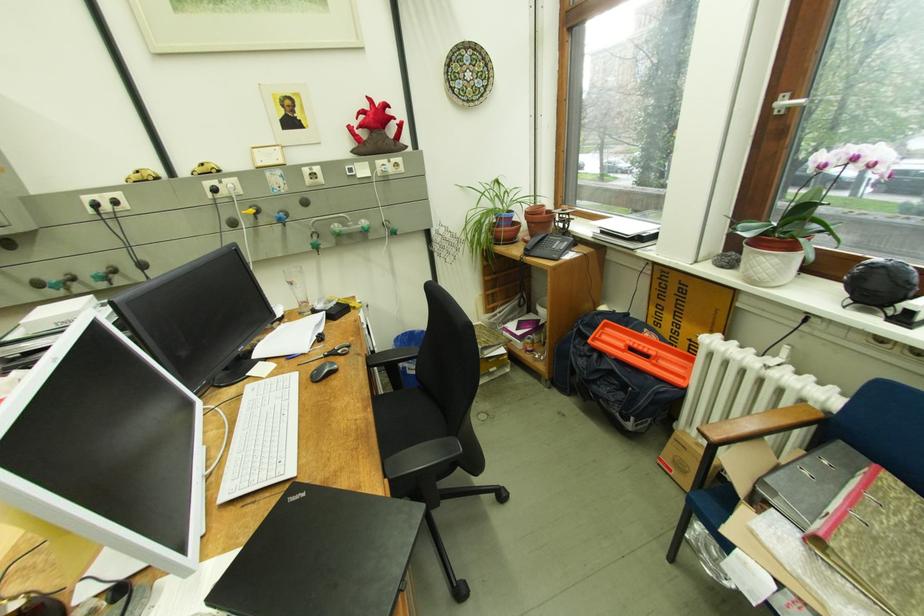
This screenshot has height=616, width=924. Describe the element at coordinates (419, 426) in the screenshot. I see `the chair sitting surface` at that location.